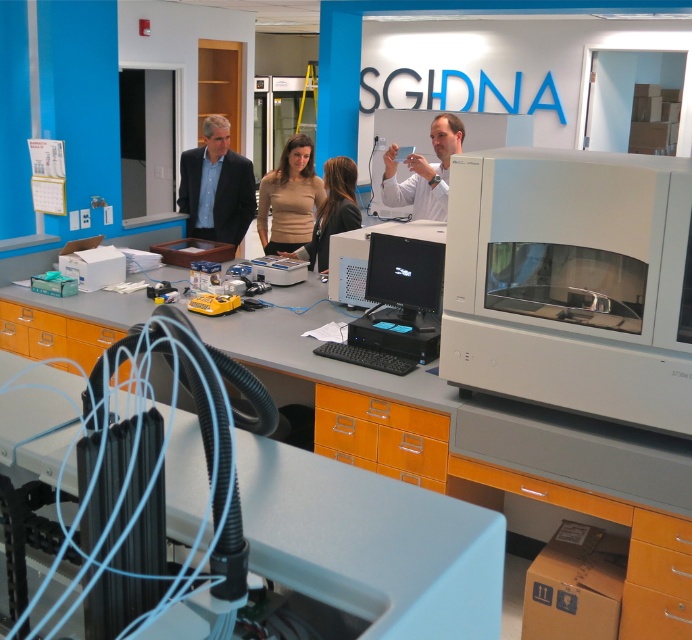
Who is shorter, orange matte/file cabinet at lower center or matte beige shirt at center?

With less height is orange matte/file cabinet at lower center.

Can you confirm if orange matte/file cabinet at lower center is taller than matte beige shirt at center?

No, orange matte/file cabinet at lower center is not taller than matte beige shirt at center.

What are the coordinates of `orange matte/file cabinet at lower center` in the screenshot? It's located at (382, 435).

Can you confirm if matte beige shirt at center is bigger than black plastic keyboard at center?

Yes, matte beige shirt at center is bigger than black plastic keyboard at center.

Between point (318, 198) and point (327, 353), which one is positioned behind?

Point (318, 198)

Which is behind, point (289, 164) or point (408, 358)?

Positioned behind is point (289, 164).

You are a GUI agent. You are given a task and a screenshot of the screen. Output one action in this format:
    pyautogui.click(x=<x>, y=<y>)
    Task: Click on the matte beige shirt at center
    The width and height of the screenshot is (692, 640).
    Given the screenshot: What is the action you would take?
    pyautogui.click(x=289, y=196)

Does point (376, 464) lie behind point (356, 353)?

No.

Is point (329, 400) farther from viewer compared to point (318, 349)?

No, it is not.

Find the location of a particular element. This screenshot has height=640, width=692. orange matte/file cabinet at lower center is located at coordinates (382, 435).